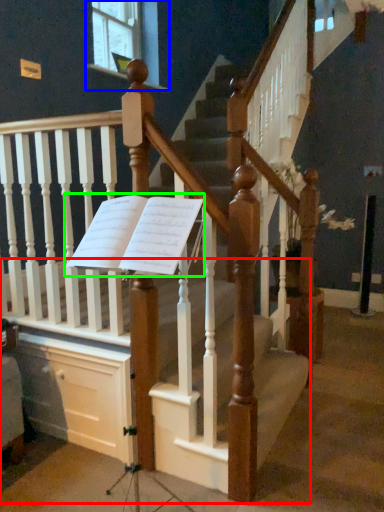
Question: Estimate the real-world distances between objects in this image. Which object is closer to stairs (highlighted by a red box), window (highlighted by a blue box) or sheet music (highlighted by a green box)?

Choices:
 (A) window
 (B) sheet music

Answer: (B)